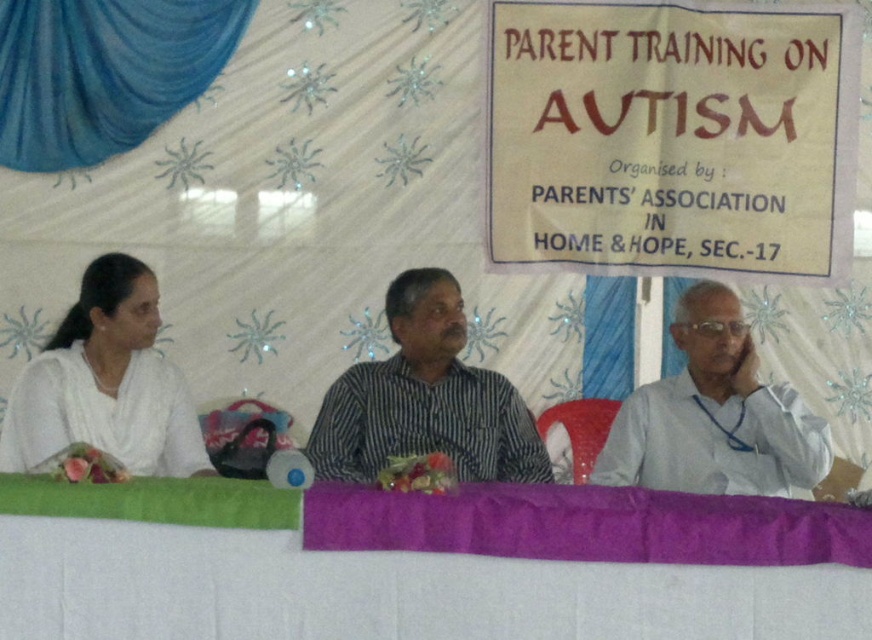
You are a photographer setting up for the event and need to adjust the camera focus. The purple fabric tablecloth at lower center and the white shirt at right are both in your frame. Given their distance, can you focus on both subjects clearly at the same time?

The purple fabric tablecloth at lower center is 31.46 inches away from the white shirt at right. Since the distance between them is relatively small, a camera with a proper aperture setting can likely keep both in focus simultaneously.

You are attending the Parent Training on Autism event and notice two items in the foreground. Which item is shorter in height between the purple fabric tablecloth at lower center and the white shirt at right?

The purple fabric tablecloth at lower center is shorter in height compared to the white shirt at right.